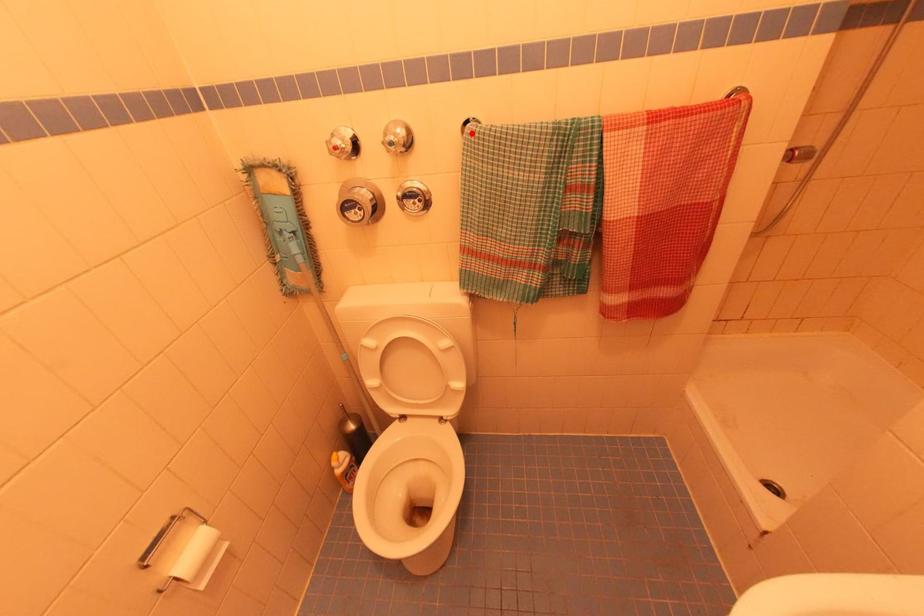
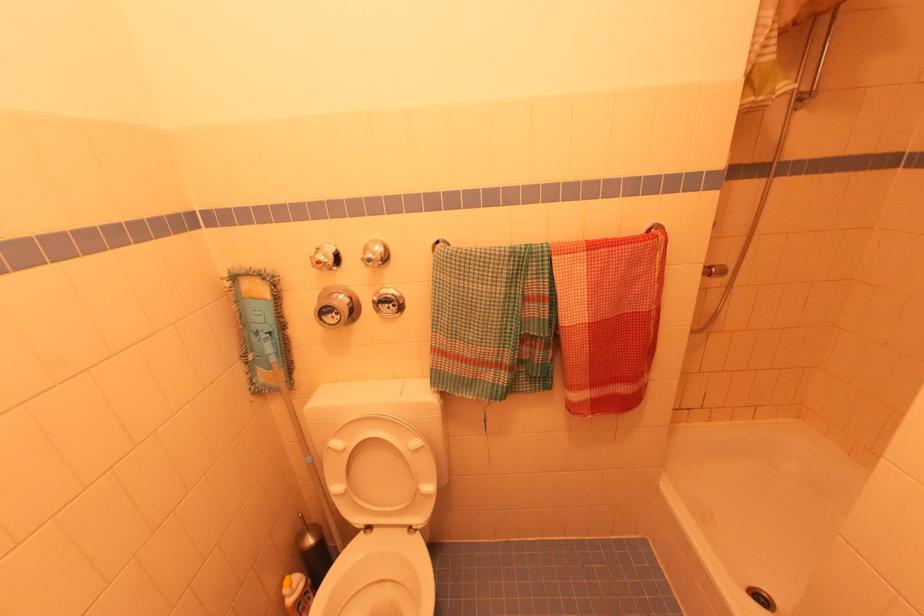
Question: I am providing you with two images of the same scene from different viewpoints. A red point is marked on the first image. At the location where the point appears in image 1, is it still visible in image 2?

Choices:
 (A) Yes
 (B) No

Answer: (A)